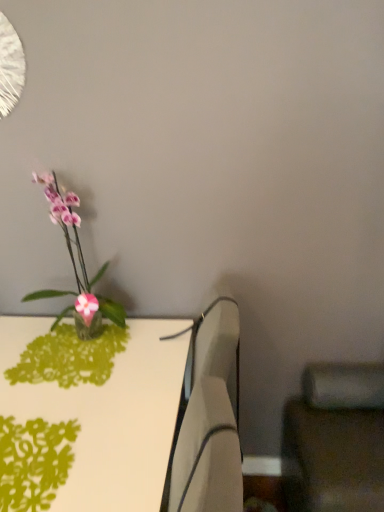
Question: In terms of size, does green papercut at lower left appear bigger or smaller than white plastic swivel chair at center, which is the second swivel chair in right-to-left order?

Choices:
 (A) small
 (B) big

Answer: (A)

Question: From the image's perspective, is green papercut at lower left positioned above or below white plastic swivel chair at center, the first swivel chair from the left?

Choices:
 (A) above
 (B) below

Answer: (B)

Question: Which of these objects is positioned closest to the green papercut at lower left?

Choices:
 (A) matte black swivel chair at lower right, which is counted as the second swivel chair, starting from the left
 (B) white plastic swivel chair at center, which is the second swivel chair in right-to-left order
 (C) matte green table at left
 (D) pink glass vase at left

Answer: (C)

Question: Estimate the real-world distances between objects in this image. Which object is closer to the pink glass vase at left?

Choices:
 (A) matte black swivel chair at lower right, which is counted as the second swivel chair, starting from the left
 (B) white plastic swivel chair at center, which is the second swivel chair in right-to-left order
 (C) matte green table at left
 (D) green papercut at lower left

Answer: (C)